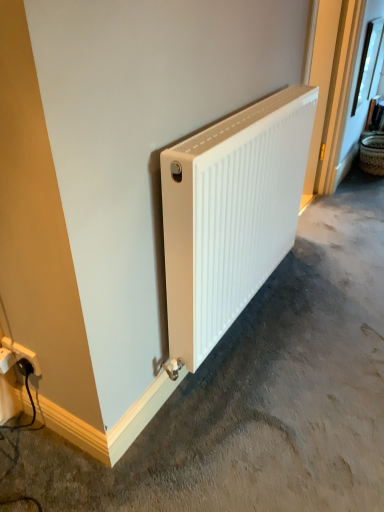
Question: In the image, is clear glass window at upper right positioned in front of or behind white matte radiator at center?

Choices:
 (A) front
 (B) behind

Answer: (B)

Question: Is clear glass window at upper right wider or thinner than white matte radiator at center?

Choices:
 (A) thin
 (B) wide

Answer: (A)

Question: Considering the real-world distances, which object is closest to the white matte radiator at center?

Choices:
 (A) white matte radiator at center
 (B) white plastic power plugs and sockets at lower left
 (C) woven brown basket at right
 (D) clear glass window at upper right

Answer: (A)

Question: Considering the real-world distances, which object is closest to the white plastic power plugs and sockets at lower left?

Choices:
 (A) woven brown basket at right
 (B) white matte radiator at center
 (C) clear glass window at upper right
 (D) white matte radiator at center

Answer: (D)